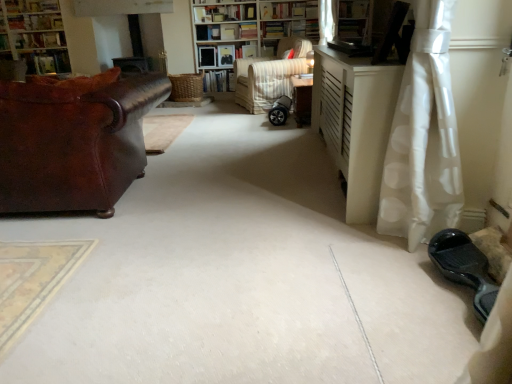
Question: From the image's perspective, does white dotted fabric at right appear lower than brown leather couch at left?

Choices:
 (A) no
 (B) yes

Answer: (B)

Question: Is the depth of white dotted fabric at right greater than that of brown leather couch at left?

Choices:
 (A) no
 (B) yes

Answer: (A)

Question: From a real-world perspective, does white dotted fabric at right sit lower than brown leather couch at left?

Choices:
 (A) yes
 (B) no

Answer: (B)

Question: Can you confirm if white dotted fabric at right is taller than brown leather couch at left?

Choices:
 (A) yes
 (B) no

Answer: (A)

Question: Is white dotted fabric at right far from brown leather couch at left?

Choices:
 (A) no
 (B) yes

Answer: (B)

Question: Is hardcover books at upper center, which appears as the sixth book when viewed from the left, situated inside matte black table at center, the first table in the back-to-front sequence, or outside?

Choices:
 (A) outside
 (B) inside

Answer: (A)

Question: From the image's perspective, relative to matte black table at center, acting as the 2th table starting from the front, is hardcover books at upper center, which appears as the sixth book when viewed from the left, above or below?

Choices:
 (A) above
 (B) below

Answer: (A)

Question: Considering the positions of hardcover books at upper center, which appears as the sixth book when viewed from the left, and matte black table at center, acting as the 2th table starting from the front, in the image, is hardcover books at upper center, which appears as the sixth book when viewed from the left, bigger or smaller than matte black table at center, acting as the 2th table starting from the front,?

Choices:
 (A) small
 (B) big

Answer: (A)

Question: Is point (269, 29) closer or farther from the camera than point (304, 84)?

Choices:
 (A) farther
 (B) closer

Answer: (A)

Question: Considering the positions of matte black table at center, acting as the 2th table starting from the front, and white textured bookcase at center, which is the first bookcase in right-to-left order, in the image, is matte black table at center, acting as the 2th table starting from the front, bigger or smaller than white textured bookcase at center, which is the first bookcase in right-to-left order,?

Choices:
 (A) big
 (B) small

Answer: (B)

Question: Considering the relative positions of matte black table at center, the first table in the back-to-front sequence, and white textured bookcase at center, which is the first bookcase in right-to-left order, in the image provided, is matte black table at center, the first table in the back-to-front sequence, to the left or to the right of white textured bookcase at center, which is the first bookcase in right-to-left order,?

Choices:
 (A) left
 (B) right

Answer: (B)

Question: Does point (303, 104) appear closer or farther from the camera than point (202, 18)?

Choices:
 (A) closer
 (B) farther

Answer: (A)

Question: In terms of width, does matte black table at center, acting as the 2th table starting from the front, look wider or thinner when compared to white textured bookcase at center, placed as the second bookcase when sorted from left to right?

Choices:
 (A) thin
 (B) wide

Answer: (A)

Question: Choose the correct answer: Is wooden bookshelf at center, arranged as the 1th shelf when viewed from the back, inside white dotted fabric at right or outside it?

Choices:
 (A) outside
 (B) inside

Answer: (A)

Question: Considering the positions of wooden bookshelf at center, the 1th shelf when ordered from top to bottom, and white dotted fabric at right in the image, is wooden bookshelf at center, the 1th shelf when ordered from top to bottom, wider or thinner than white dotted fabric at right?

Choices:
 (A) wide
 (B) thin

Answer: (B)